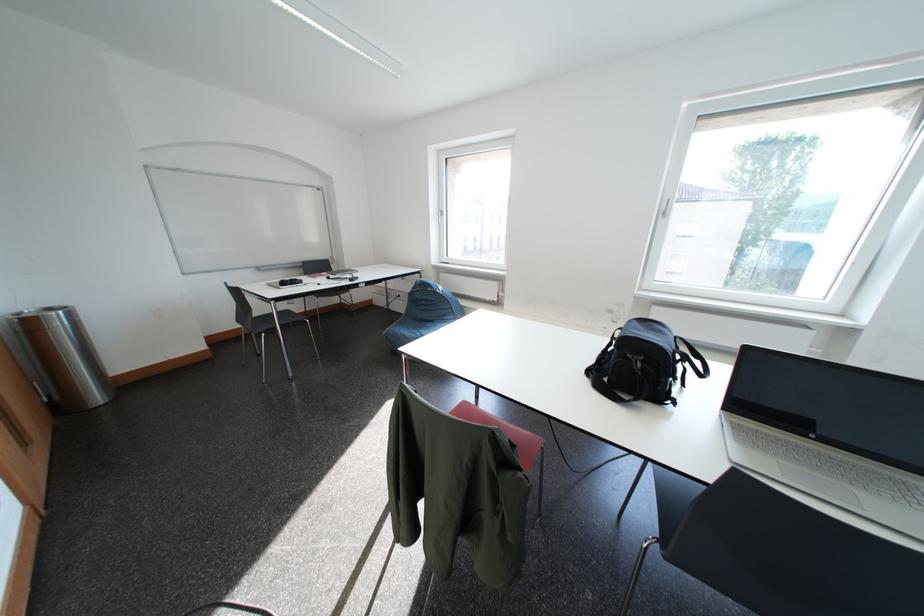
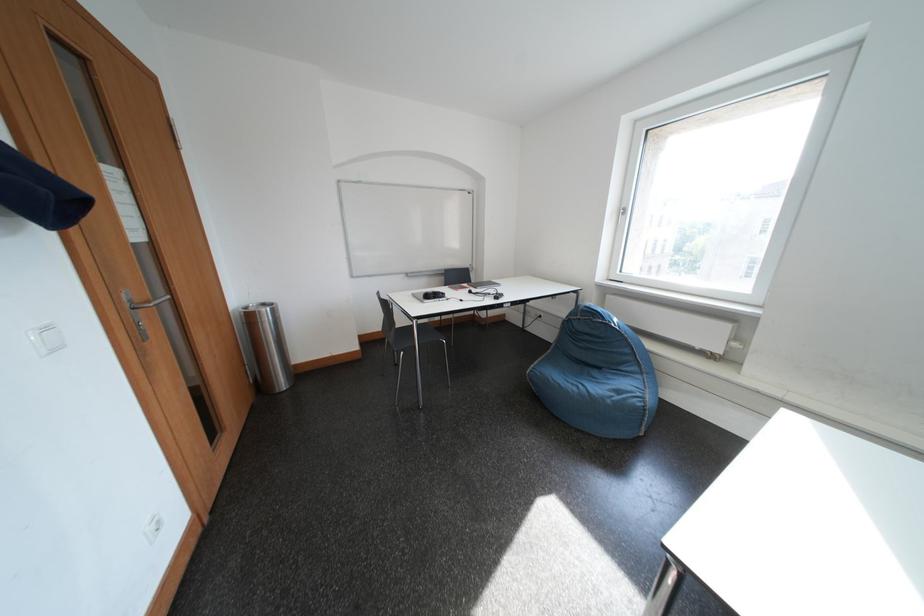
Question: The first image is from the beginning of the video and the second image is from the end. How did the camera likely rotate when shooting the video?

Choices:
 (A) Left
 (B) Right
 (C) Up
 (D) Down

Answer: (A)